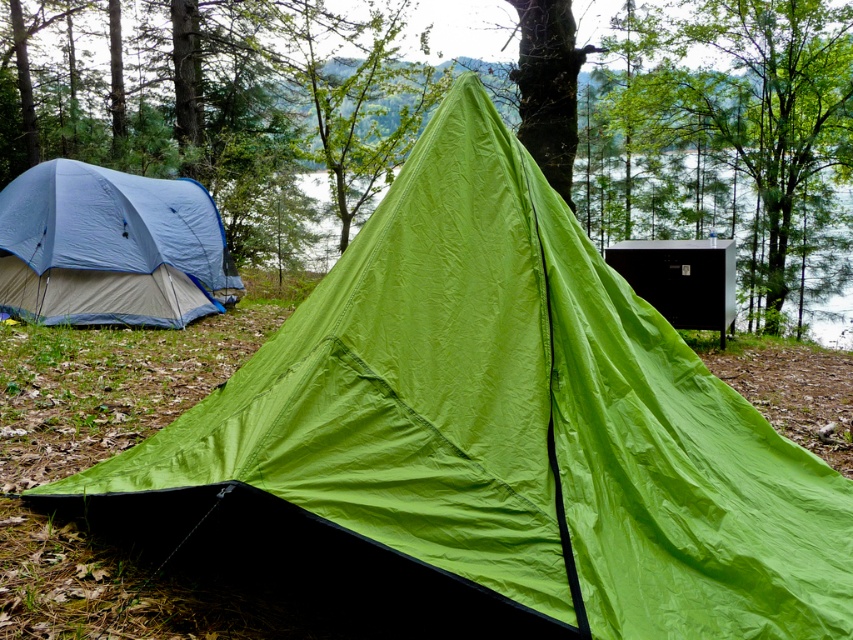
Question: Which point is farther to the camera?

Choices:
 (A) green fabric tent at center
 (B) green matte tree at upper right

Answer: (B)

Question: Which of the following is the closest to the observer?

Choices:
 (A) matte blue tent at left
 (B) green fabric tent at center

Answer: (A)

Question: Which object appears closest to the camera in this image?

Choices:
 (A) green fabric tent at center
 (B) matte blue tent at left
 (C) green matte tree at upper right

Answer: (B)

Question: Can you confirm if green fabric tent at center is positioned to the right of matte blue tent at left?

Choices:
 (A) yes
 (B) no

Answer: (A)

Question: Does green fabric tent at center have a larger size compared to green matte tree at upper right?

Choices:
 (A) no
 (B) yes

Answer: (B)

Question: Considering the relative positions of green fabric tent at center and matte blue tent at left in the image provided, where is green fabric tent at center located with respect to matte blue tent at left?

Choices:
 (A) below
 (B) above

Answer: (B)